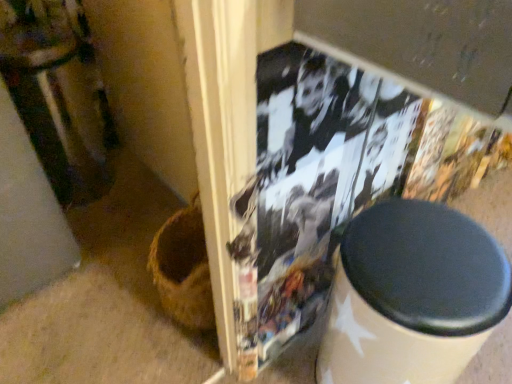
Where is `white matte waste container at lower right`? white matte waste container at lower right is located at coordinates (412, 296).

The image size is (512, 384). What do you see at coordinates (412, 296) in the screenshot? I see `white matte waste container at lower right` at bounding box center [412, 296].

This screenshot has height=384, width=512. Identify the location of white matte waste container at lower right. (412, 296).